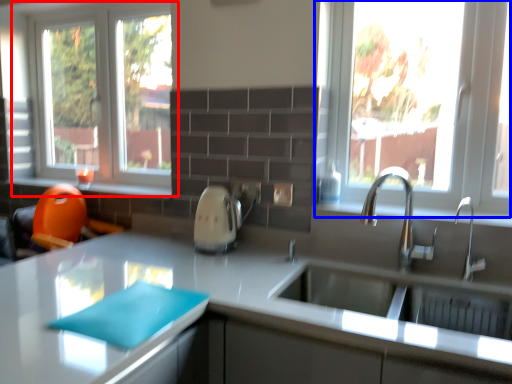
Question: Which object is further to the camera taking this photo, window (highlighted by a red box) or window (highlighted by a blue box)?

Choices:
 (A) window
 (B) window

Answer: (A)